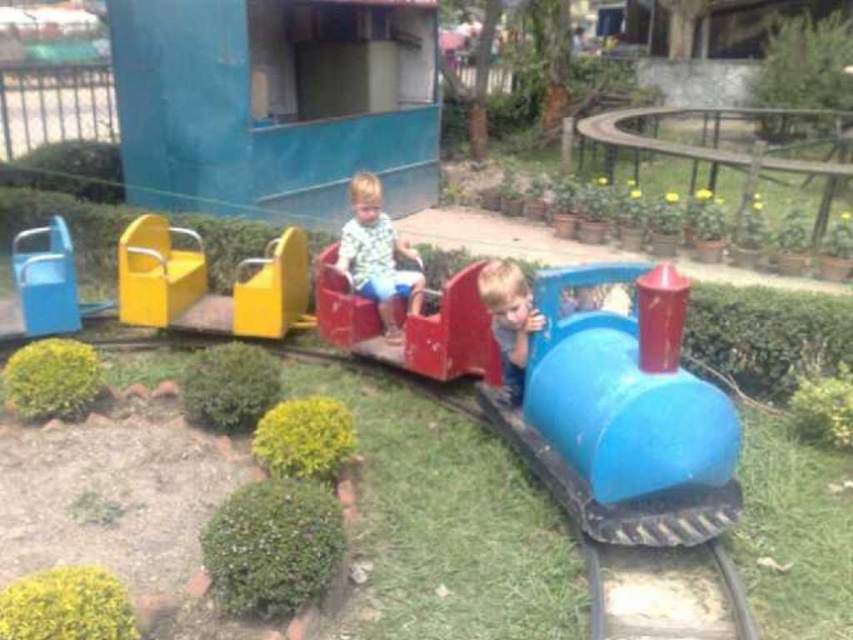
You are a parent waiting at the station and see your child sitting in the train. You notice the metallic yellow seat at left and the matte green shirt at center. Which object is higher in position?

The metallic yellow seat at left is located above the matte green shirt at center, so the metallic yellow seat at left is higher in position.